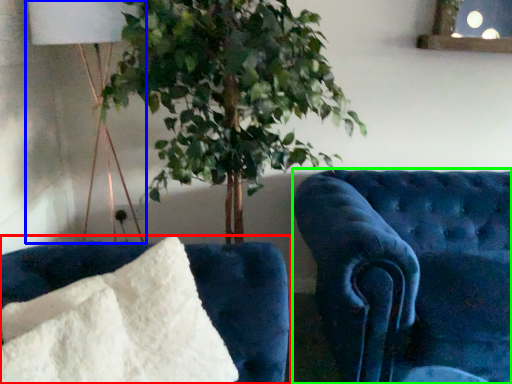
Question: Estimate the real-world distances between objects in this image. Which object is farther from furniture (highlighted by a red box), table lamp (highlighted by a blue box) or furniture (highlighted by a green box)?

Choices:
 (A) table lamp
 (B) furniture

Answer: (A)